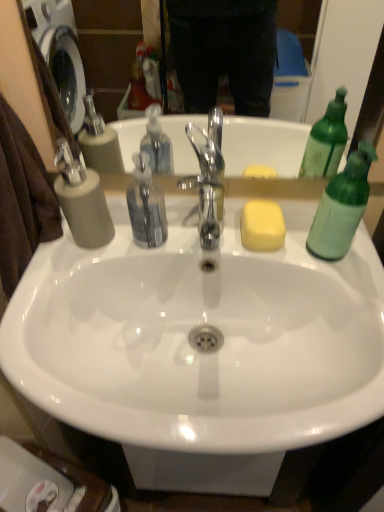
Where is `vacant area that is situated to the right of yellow matte soap at center`? This screenshot has height=512, width=384. vacant area that is situated to the right of yellow matte soap at center is located at coordinates (316, 252).